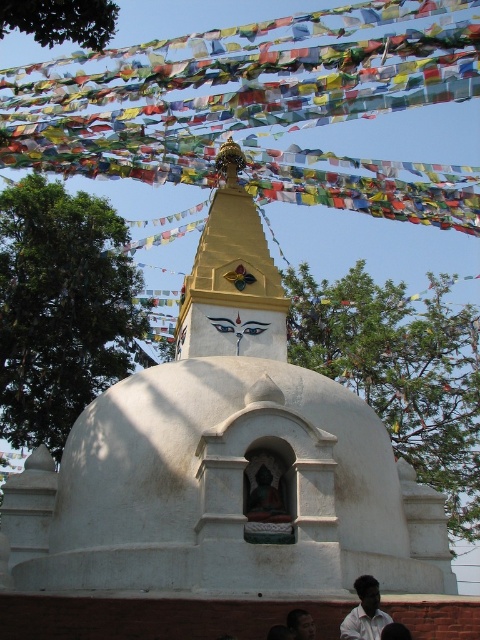
Is white shirt at lower right bigger than dark skin human face at lower center?

No.

Between white shirt at lower right and dark skin human face at lower center, which one appears on the left side from the viewer's perspective?

Positioned to the left is dark skin human face at lower center.

Between point (374, 582) and point (309, 621), which one is positioned behind?

The point (374, 582) is behind.

Locate an element on the screen. This screenshot has height=640, width=480. white shirt at lower right is located at coordinates (364, 612).

Who is more forward, (251, 515) or (296, 634)?

Point (296, 634) is more forward.

This screenshot has height=640, width=480. What are the coordinates of `matte gold statue at center` in the screenshot? It's located at (265, 499).

Between point (268, 515) and point (292, 632), which one is positioned in front?

Point (292, 632)

You are a GUI agent. You are given a task and a screenshot of the screen. Output one action in this format:
    pyautogui.click(x=<x>, y=<y>)
    Task: Click on the matte gold statue at center
    The image size is (480, 640).
    Given the screenshot: What is the action you would take?
    pyautogui.click(x=265, y=499)

Between white shirt at lower right and matte gold statue at center, which one has more height?

matte gold statue at center is taller.

Does white shirt at lower right appear on the right side of matte gold statue at center?

Correct, you'll find white shirt at lower right to the right of matte gold statue at center.

Does point (360, 580) come farther from viewer compared to point (261, 490)?

No, (360, 580) is closer to viewer.

The image size is (480, 640). I want to click on white shirt at lower right, so click(x=364, y=612).